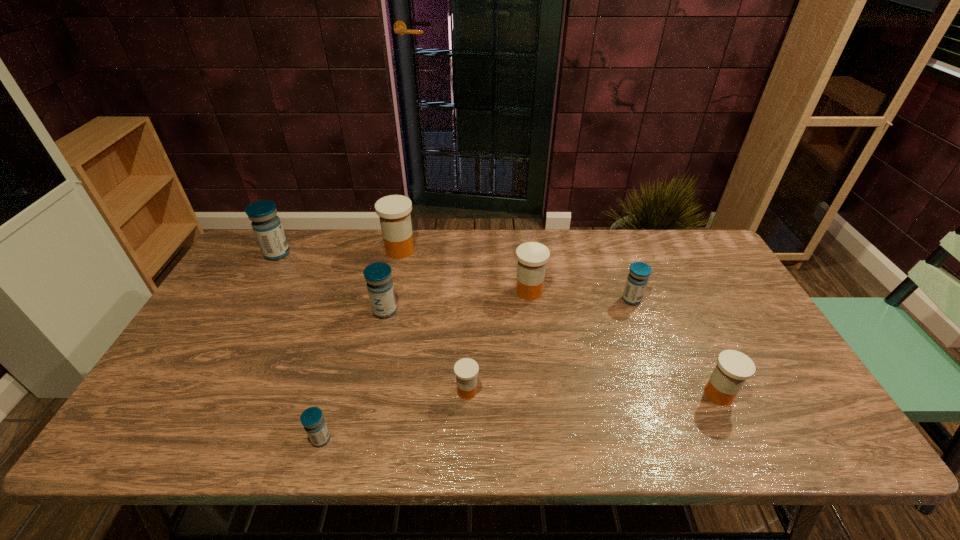
Identify the location of vacant point located 0.310m on the back of the third blue medicine from left to right. (401, 239).

Find the location of a particular element. The image size is (960, 540). vacant area situated on the back of the second smallest blue medicine is located at coordinates (625, 282).

Locate an element on the screen. free region located 0.180m on the label of the fourth object from right to left is located at coordinates (554, 391).

The image size is (960, 540). What are the coordinates of `vacant space located on the right of the nearest blue medicine` in the screenshot? It's located at (471, 439).

Where is `object present at the near edge`? object present at the near edge is located at coordinates (312, 419).

Where is `object present at the left edge`? Image resolution: width=960 pixels, height=540 pixels. object present at the left edge is located at coordinates (266, 225).

In order to click on object situated at the far left corner in this screenshot , I will do `click(266, 225)`.

The image size is (960, 540). Find the location of `vacant space at the far edge of the desktop`. vacant space at the far edge of the desktop is located at coordinates (418, 250).

Locate an element on the screen. free point at the left edge is located at coordinates (216, 352).

Locate an element on the screen. This screenshot has height=540, width=960. vacant space at the right edge is located at coordinates (706, 321).